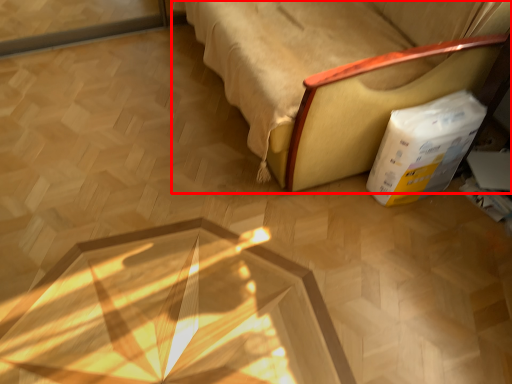
Question: Where is furniture (annotated by the red box) located in relation to cardboard box in the image?

Choices:
 (A) left
 (B) right

Answer: (A)